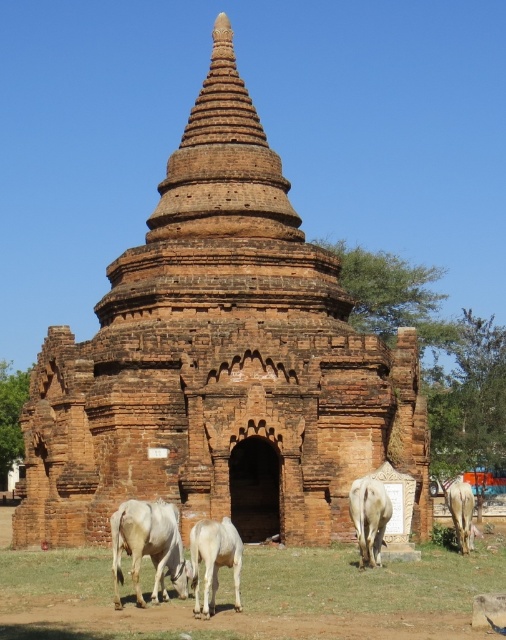
Question: Which object appears farthest from the camera in this image?

Choices:
 (A) green grass at lower center
 (B) reddish-brown brick pagoda at center
 (C) white matte cow at lower right

Answer: (B)

Question: Which point is closer to the camera?

Choices:
 (A) white smooth cow at lower right
 (B) white matte cow at lower right
 (C) white matte cow at lower center

Answer: (C)

Question: Which object is closer to the camera taking this photo?

Choices:
 (A) white smooth cow at lower left
 (B) green grass at lower center
 (C) reddish-brown brick pagoda at center
 (D) white matte cow at lower right

Answer: (A)

Question: Can you confirm if reddish-brown brick pagoda at center is smaller than white matte cow at lower center?

Choices:
 (A) no
 (B) yes

Answer: (A)

Question: Does reddish-brown brick pagoda at center come in front of green grass at lower center?

Choices:
 (A) yes
 (B) no

Answer: (B)

Question: Is reddish-brown brick pagoda at center positioned behind white smooth cow at lower left?

Choices:
 (A) no
 (B) yes

Answer: (B)